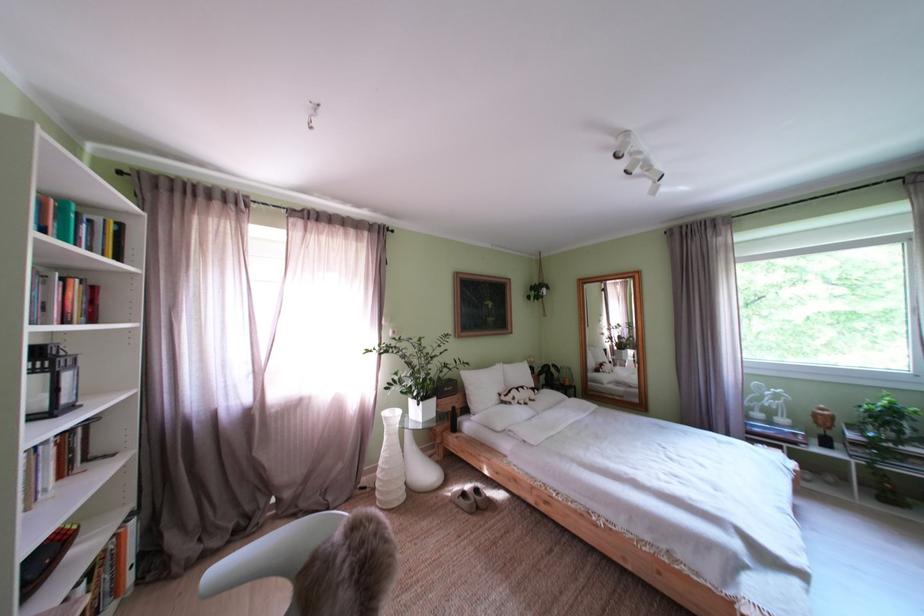
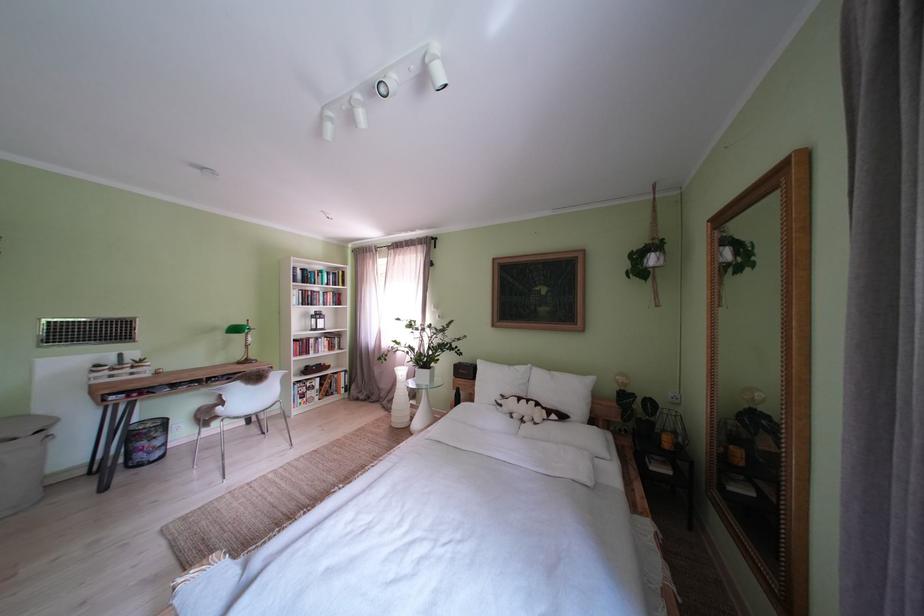
In the second image, find the point that corresponds to the point at 525,405 in the first image.

(512, 411)